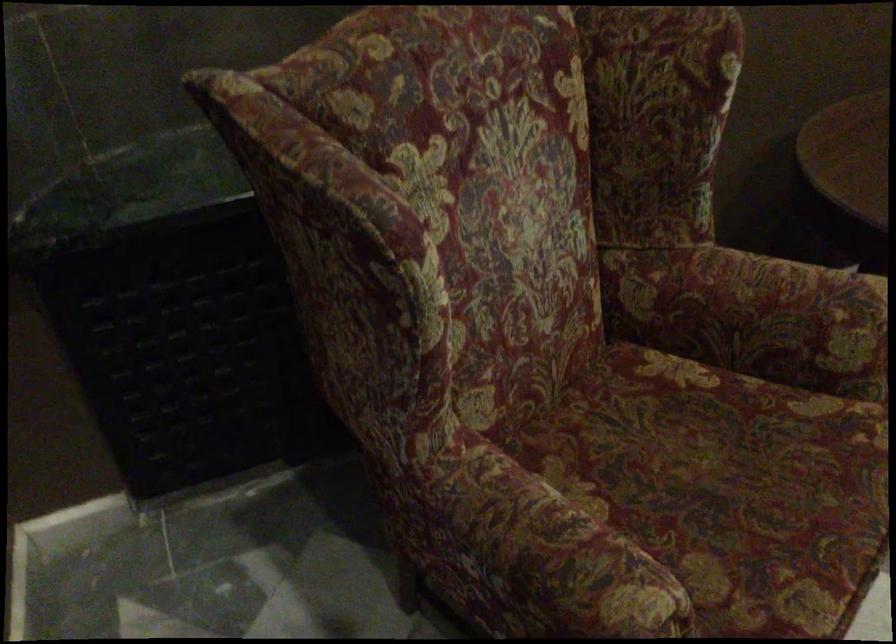
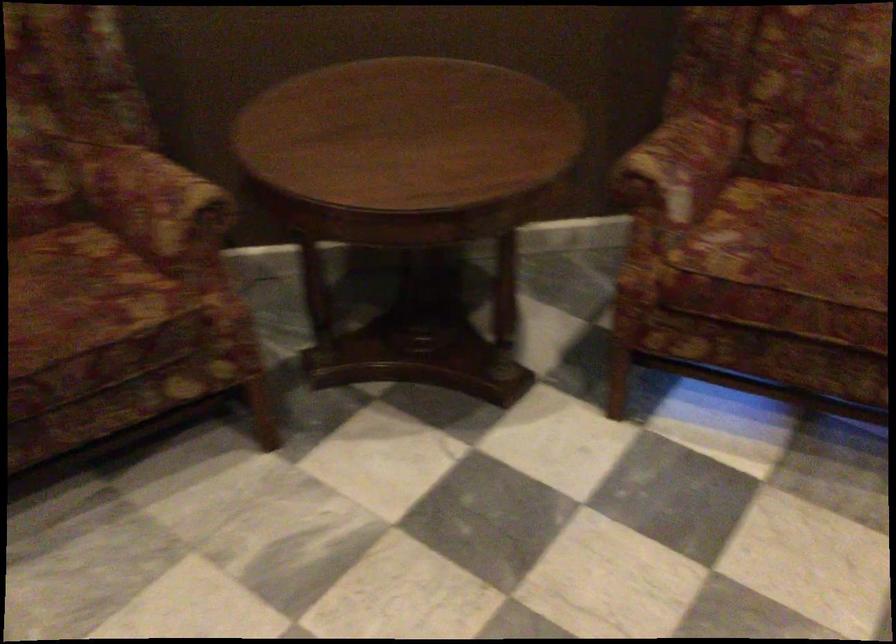
Find the pixel in the second image that matches (776,440) in the first image.

(80, 292)